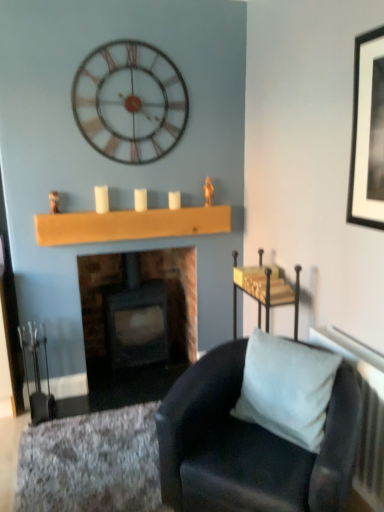
Question: From the image's perspective, relative to textured gray rug at lower left, is suede-like gray pillow at lower right above or below?

Choices:
 (A) below
 (B) above

Answer: (B)

Question: From a real-world perspective, relative to textured gray rug at lower left, is suede-like gray pillow at lower right vertically above or below?

Choices:
 (A) above
 (B) below

Answer: (A)

Question: Estimate the real-world distances between objects in this image. Which object is farther from the dark gray stone fireplace at center?

Choices:
 (A) metallic/wooden wall clock at upper center
 (B) metallic gold tray at upper right
 (C) suede-like gray pillow at lower right
 (D) white matte candle at center, the second candle viewed from the right
 (E) white matte candle at center, the 1th candle in the right-to-left sequence

Answer: (C)

Question: Which of these objects is positioned farthest from the suede-like gray pillow at lower right?

Choices:
 (A) textured gray rug at lower left
 (B) metallic gold tray at upper right
 (C) metallic/wooden wall clock at upper center
 (D) suede-like black chair at lower right
 (E) dark gray stone fireplace at center

Answer: (C)